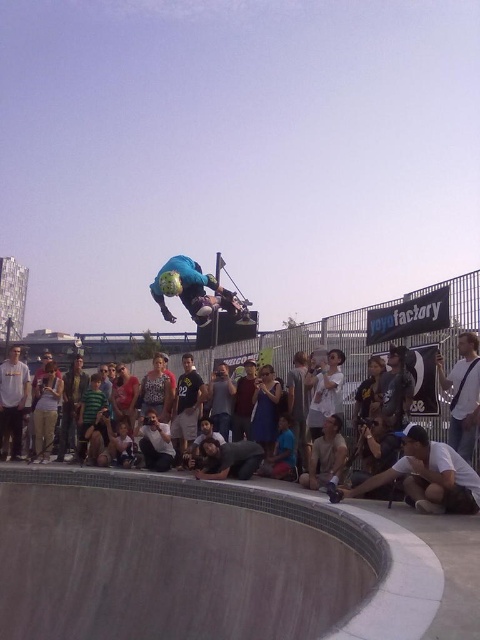
Question: Estimate the real-world distances between objects in this image. Which object is farther from the green striped shirt at center?

Choices:
 (A) denim jacket at center
 (B) blue dress at center

Answer: (B)

Question: Does blue matte helmet at center appear on the right side of green jersey at center?

Choices:
 (A) no
 (B) yes

Answer: (B)

Question: Can you confirm if white cotton t-shirt at center is thinner than dark blue shirt at center?

Choices:
 (A) yes
 (B) no

Answer: (A)

Question: Which object is the farthest from the white cotton t-shirt at center?

Choices:
 (A) green jersey at center
 (B) red shirt at center
 (C) white matte shirt at lower right
 (D) black leather jacket at center

Answer: (A)

Question: Which point is closer to the camera taking this photo?

Choices:
 (A) (7, 596)
 (B) (15, 384)
 (C) (432, 490)
 (D) (120, 376)

Answer: (C)

Question: Is green jersey at center bigger than green striped shirt at center?

Choices:
 (A) no
 (B) yes

Answer: (B)